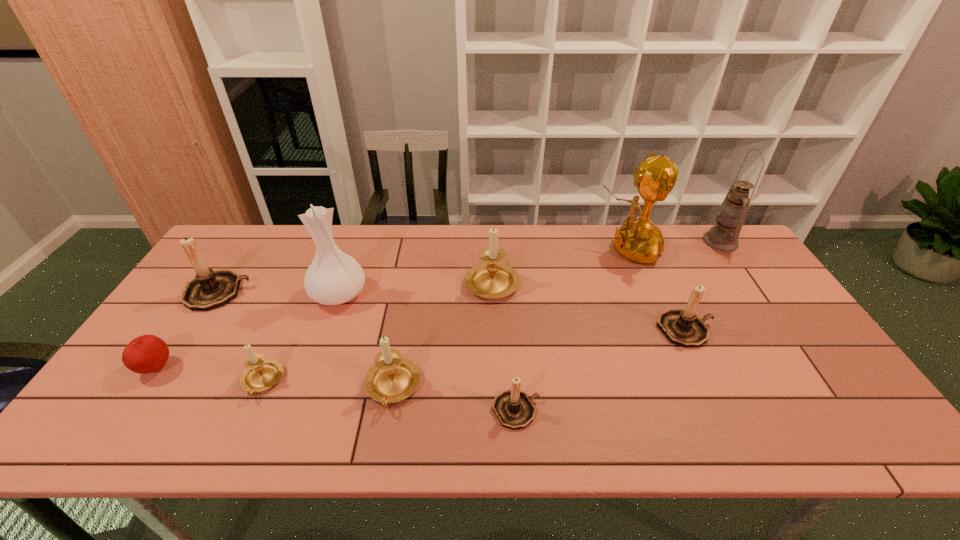
Identify the location of blank space located 0.070m with a handle on the side of the leftmost beige candle holder. (241, 430).

Locate an element on the screen. The width and height of the screenshot is (960, 540). vacant area situated 0.320m on the left of the second brown candle holder from right to left is located at coordinates point(353,410).

Image resolution: width=960 pixels, height=540 pixels. Find the location of `vacant space located 0.360m on the right of the red apple`. vacant space located 0.360m on the right of the red apple is located at coordinates click(x=318, y=368).

In order to click on award at the far edge in this screenshot , I will do `click(638, 240)`.

Where is `oil lamp that is at the far edge`? oil lamp that is at the far edge is located at coordinates pos(730,218).

This screenshot has width=960, height=540. What are the coordinates of `candle holder that is at the far edge` in the screenshot? It's located at (492, 279).

At what (x,y) coordinates should I click in order to perform the action: click on candle holder that is at the left edge. Please return your answer as a coordinate pair (x, y). Looking at the image, I should click on (210, 289).

Identify the location of apple located in the left edge section of the desktop. The width and height of the screenshot is (960, 540). (145, 354).

Find the location of a particular element. object at the right edge is located at coordinates (730, 218).

This screenshot has width=960, height=540. I want to click on object at the far right corner, so click(x=730, y=218).